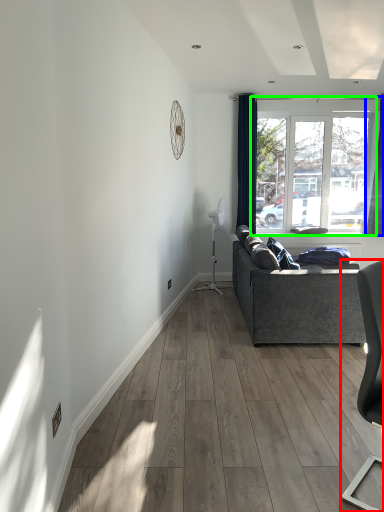
Question: Estimate the real-world distances between objects in this image. Which object is closer to chair (highlighted by a red box), curtain (highlighted by a blue box) or window (highlighted by a green box)?

Choices:
 (A) curtain
 (B) window

Answer: (B)